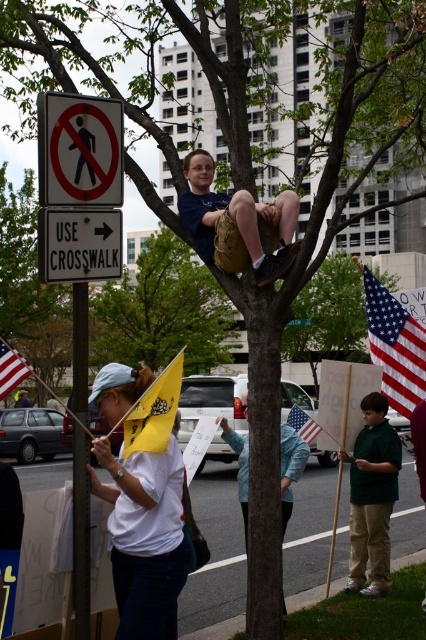
Looking at this image, you are a pedestrian trying to cross the street. You see the green matte shirt at lower right and the white plastic sign at upper left. Which object is higher up in the image?

The green matte shirt at lower right is much taller than the white plastic sign at upper left, so the green matte shirt at lower right is higher up in the image.

You are a pedestrian trying to find the crosswalk. You see a white matte shirt at center and a black plastic pole at left. Which object is closer to the crosswalk?

The white matte shirt at center is to the right of the black plastic pole at left. Since the black plastic pole at left has a sign indicating a pedestrian crossing area, it is likely closer to the crosswalk than the white matte shirt at center.

You are a photographer standing at the center of the street. You want to take a photo that includes both the point at coordinates point(380,452) and point(77,269). Which point should you focus on first to ensure both are in the frame?

You should focus on point(380,452) first because it is closer to you than point(77,269), ensuring both points are within the frame.